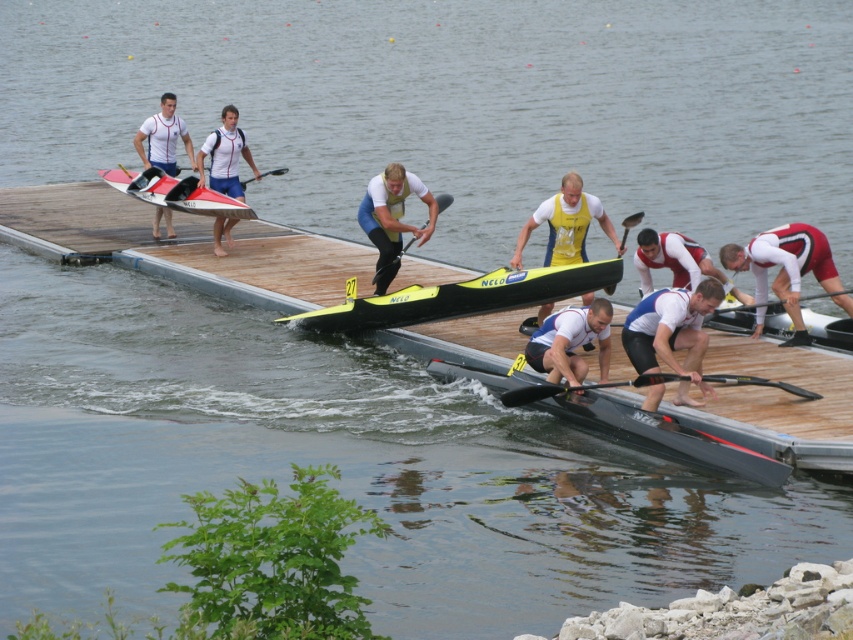
You are a photographer standing at the dock. You want to take a photo of the white matte kayak at center and the black rubber paddle at lower right. Which object will appear larger in your photo?

The white matte kayak at center will appear larger in the photo because it is closer to the viewer than the black rubber paddle at lower right.

What is the object located at the point with coordinates (671, 330) in the image?

The point at coordinates (671, 330) indicates a white matte kayak at center.

You are a photographer standing at the dock trying to capture a photo of the white fabric shirt at center and the black rubber paddle at center. Your camera has a maximum focus range of 3 meters. Can you focus on both objects at the same time?

The distance between the white fabric shirt at center and the black rubber paddle at center is 3.06 meters. Since the camera can only focus within 3 meters, the objects are slightly out of range, so you cannot focus on both simultaneously.